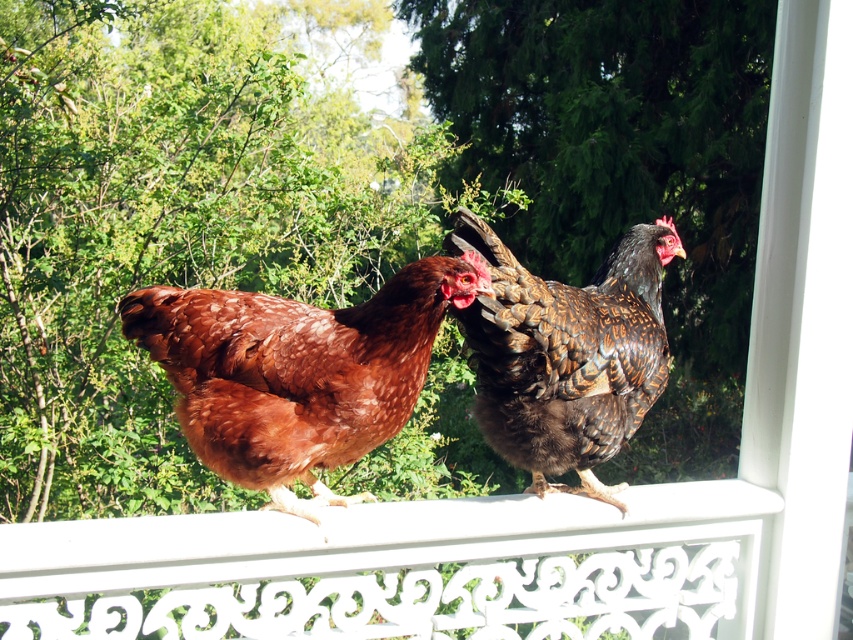
You are a farmer checking on your chickens in the garden. You notice two chickens on the ornate white railing. Which chicken is closer to the left side of the railing? The brown feathered chicken at center or the brown speckled chicken at center?

The brown feathered chicken at center is positioned on the left side of the brown speckled chicken at center, so the brown feathered chicken at center is closer to the left side of the railing.

You are a photographer trying to capture a clear shot of both chickens. Since you want to focus on the brown feathered chicken at center, which is in front, will the brown speckled chicken at center be partially hidden behind it?

The brown feathered chicken at center is closer to the viewer than the brown speckled chicken at center, so yes, the brown speckled chicken at center will be partially hidden behind the brown feathered chicken at center.

You are a photographer aiming to capture a closeup shot of the brown feathered chicken at center. Given that your camera can focus on subjects within 5 feet, will you need to move closer or farther away to get a clear shot?

The brown feathered chicken at center is 7.01 feet away from the camera, which is beyond the 5 feet focusing range. To get a clear shot, you need to move closer to reduce the distance.